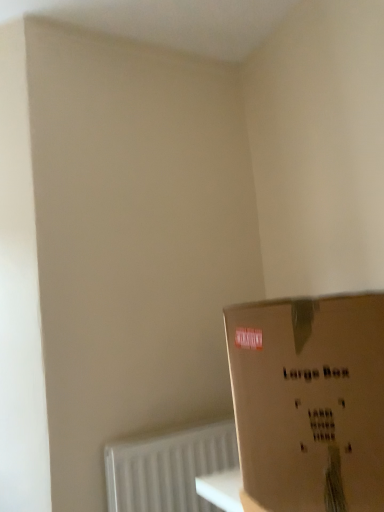
Question: Is white textured radiator at lower left with brown cardboard box at lower right?

Choices:
 (A) no
 (B) yes

Answer: (A)

Question: Does white textured radiator at lower left appear on the left side of brown cardboard box at lower right?

Choices:
 (A) no
 (B) yes

Answer: (B)

Question: Is white textured radiator at lower left facing towards brown cardboard box at lower right?

Choices:
 (A) yes
 (B) no

Answer: (A)

Question: Can you confirm if white textured radiator at lower left is taller than brown cardboard box at lower right?

Choices:
 (A) yes
 (B) no

Answer: (B)

Question: Considering the relative positions of white textured radiator at lower left and brown cardboard box at lower right in the image provided, is white textured radiator at lower left behind brown cardboard box at lower right?

Choices:
 (A) no
 (B) yes

Answer: (B)

Question: Can brown cardboard box at lower right be found inside white textured radiator at lower left?

Choices:
 (A) no
 (B) yes

Answer: (A)

Question: From the image's perspective, is brown cardboard box at lower right located beneath white textured radiator at lower left?

Choices:
 (A) yes
 (B) no

Answer: (B)

Question: Is brown cardboard box at lower right directly adjacent to white textured radiator at lower left?

Choices:
 (A) yes
 (B) no

Answer: (B)

Question: Considering the relative positions of brown cardboard box at lower right and white textured radiator at lower left in the image provided, is brown cardboard box at lower right to the left of white textured radiator at lower left from the viewer's perspective?

Choices:
 (A) no
 (B) yes

Answer: (A)

Question: Can you confirm if brown cardboard box at lower right is taller than white textured radiator at lower left?

Choices:
 (A) yes
 (B) no

Answer: (A)

Question: Does brown cardboard box at lower right come behind white textured radiator at lower left?

Choices:
 (A) yes
 (B) no

Answer: (B)

Question: Can you confirm if brown cardboard box at lower right is shorter than white textured radiator at lower left?

Choices:
 (A) yes
 (B) no

Answer: (B)

Question: Visually, is white textured radiator at lower left positioned to the left or to the right of brown cardboard box at lower right?

Choices:
 (A) left
 (B) right

Answer: (A)